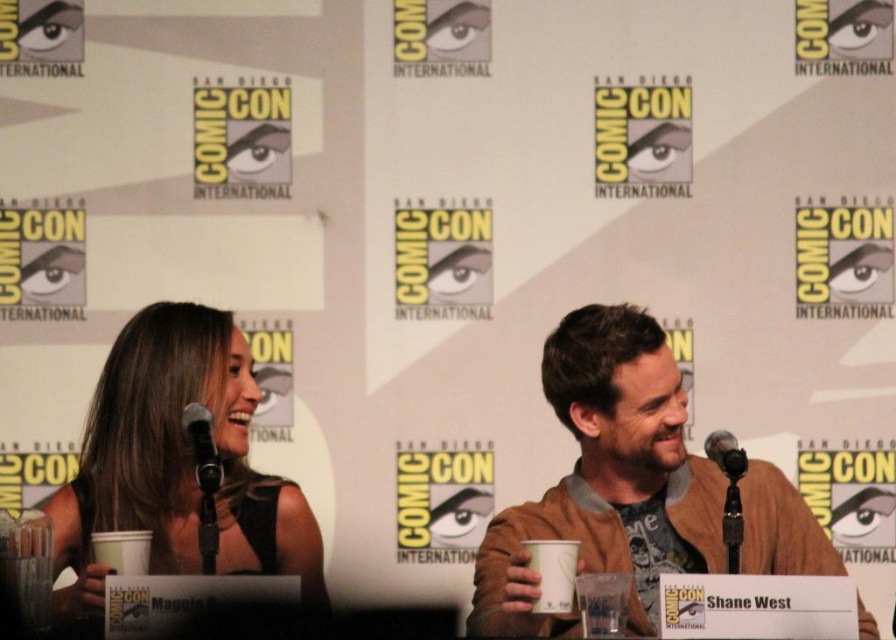
Question: Which object is closer to the camera taking this photo?

Choices:
 (A) black metallic microphone at right
 (B) brown leather jacket at center
 (C) black matte dress at left

Answer: (B)

Question: Which of the following is the closest to the observer?

Choices:
 (A) (96, 528)
 (B) (197, 464)

Answer: (B)

Question: Where is black matte dress at left located in relation to black metallic microphone at right in the image?

Choices:
 (A) right
 (B) left

Answer: (B)

Question: Does brown leather jacket at center have a smaller size compared to black matte dress at left?

Choices:
 (A) no
 (B) yes

Answer: (A)

Question: Can you confirm if brown leather jacket at center is positioned below black matte dress at left?

Choices:
 (A) no
 (B) yes

Answer: (B)

Question: Which point is closer to the camera?

Choices:
 (A) (507, 547)
 (B) (714, 438)
 (C) (197, 461)

Answer: (C)